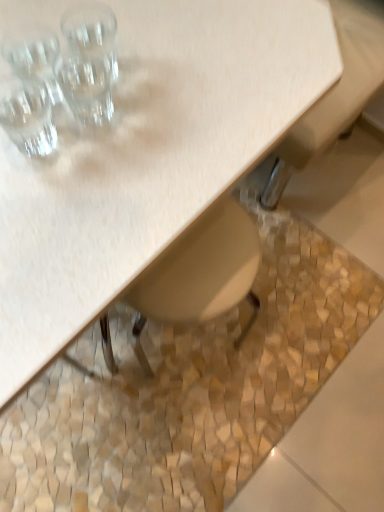
Question: Is beige mosaic tile at lower center shorter than transparent glass at upper left, the third shot glass ordered from the bottom?

Choices:
 (A) no
 (B) yes

Answer: (B)

Question: Is beige mosaic tile at lower center to the left of transparent glass at upper left, which is the 1th shot glass in top-to-bottom order, from the viewer's perspective?

Choices:
 (A) no
 (B) yes

Answer: (A)

Question: Is beige mosaic tile at lower center not within transparent glass at upper left, which is the 1th shot glass in top-to-bottom order?

Choices:
 (A) no
 (B) yes

Answer: (B)

Question: Considering the relative positions of beige mosaic tile at lower center and transparent glass at upper left, the third shot glass ordered from the bottom, in the image provided, is beige mosaic tile at lower center to the right of transparent glass at upper left, the third shot glass ordered from the bottom, from the viewer's perspective?

Choices:
 (A) no
 (B) yes

Answer: (B)

Question: Is beige mosaic tile at lower center turned away from transparent glass at upper left, the third shot glass ordered from the bottom?

Choices:
 (A) yes
 (B) no

Answer: (B)

Question: Considering the relative sizes of beige mosaic tile at lower center and transparent glass at upper left, which is the 1th shot glass in top-to-bottom order, in the image provided, is beige mosaic tile at lower center thinner than transparent glass at upper left, which is the 1th shot glass in top-to-bottom order,?

Choices:
 (A) yes
 (B) no

Answer: (B)

Question: Is transparent glass at upper left, which is the 1th shot glass in top-to-bottom order, positioned behind matte wood table at upper left?

Choices:
 (A) no
 (B) yes

Answer: (B)

Question: Can you confirm if transparent glass at upper left, the third shot glass ordered from the bottom, is smaller than matte wood table at upper left?

Choices:
 (A) no
 (B) yes

Answer: (B)

Question: Does transparent glass at upper left, which is the 1th shot glass in top-to-bottom order, have a lesser height compared to matte wood table at upper left?

Choices:
 (A) yes
 (B) no

Answer: (A)

Question: Can you confirm if transparent glass at upper left, which is the 1th shot glass in top-to-bottom order, is bigger than matte wood table at upper left?

Choices:
 (A) no
 (B) yes

Answer: (A)

Question: From a real-world perspective, does transparent glass at upper left, the third shot glass ordered from the bottom, sit lower than matte wood table at upper left?

Choices:
 (A) no
 (B) yes

Answer: (A)

Question: Does transparent glass at upper left, the third shot glass ordered from the bottom, have a greater height compared to matte wood table at upper left?

Choices:
 (A) no
 (B) yes

Answer: (A)

Question: Is clear glass shot glass at upper left, which appears as the 1th shot glass when ordered from the bottom, located within matte wood table at upper left?

Choices:
 (A) yes
 (B) no

Answer: (B)